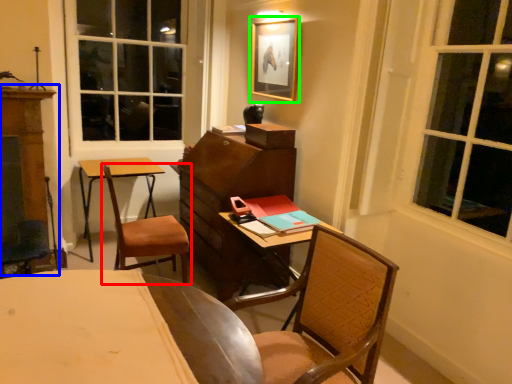
Question: Which object is positioned closest to chair (highlighted by a red box)? Select from dresser (highlighted by a blue box) and picture frame (highlighted by a green box).

Choices:
 (A) dresser
 (B) picture frame

Answer: (A)